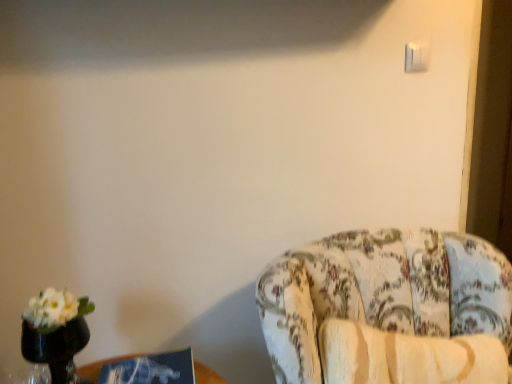
From the picture: Measure the distance between point (423, 67) and camera.

The depth of point (423, 67) is 1.33 meters.

The width and height of the screenshot is (512, 384). Describe the element at coordinates (416, 57) in the screenshot. I see `white plastic light switch at upper right` at that location.

Measure the distance between blue cardboard box at lower left and camera.

They are 3.59 feet apart.

Describe the element at coordinates (388, 309) in the screenshot. The image size is (512, 384). I see `floral fabric chair at right` at that location.

I want to click on white plastic light switch at upper right, so click(416, 57).

Can you confirm if floral fabric chair at right is shorter than blue cardboard box at lower left?

Incorrect, the height of floral fabric chair at right does not fall short of that of blue cardboard box at lower left.

From a real-world perspective, who is located higher, floral fabric chair at right or blue cardboard box at lower left?

blue cardboard box at lower left is physically above.

Can you see floral fabric chair at right touching blue cardboard box at lower left?

No, floral fabric chair at right is not beside blue cardboard box at lower left.

From the image's perspective, is floral fabric chair at right on white plastic light switch at upper right?

No.

Is floral fabric chair at right to the right of white plastic light switch at upper right from the viewer's perspective?

No.

This screenshot has width=512, height=384. Identify the location of chair that appears in front of the white plastic light switch at upper right. (388, 309).

Which object is positioned more to the right, white plastic light switch at upper right or floral fabric chair at right?

Positioned to the right is white plastic light switch at upper right.

Which is less distant, (426,53) or (416,322)?

Point (426,53).

Can you tell me how much white plastic light switch at upper right and floral fabric chair at right differ in facing direction?

white plastic light switch at upper right and floral fabric chair at right are facing 5.2 degrees away from each other.

From a real-world perspective, is white plastic light switch at upper right positioned above or below floral fabric chair at right?

white plastic light switch at upper right is above floral fabric chair at right.

Is the position of blue cardboard box at lower left less distant than that of white plastic light switch at upper right?

That is True.

From a real-world perspective, which is physically above, blue cardboard box at lower left or white plastic light switch at upper right?

white plastic light switch at upper right, from a real-world perspective.

What's the angular difference between blue cardboard box at lower left and white plastic light switch at upper right's facing directions?

9.8 degrees separate the facing orientations of blue cardboard box at lower left and white plastic light switch at upper right.

Is blue cardboard box at lower left wider or thinner than floral fabric chair at right?

In the image, blue cardboard box at lower left appears to be more narrow than floral fabric chair at right.

From the image's perspective, which one is positioned higher, blue cardboard box at lower left or floral fabric chair at right?

floral fabric chair at right, from the image's perspective.

Which of these two, blue cardboard box at lower left or floral fabric chair at right, is smaller?

blue cardboard box at lower left is smaller.

Does blue cardboard box at lower left appear on the left side of floral fabric chair at right?

Yes.

Is the surface of white plastic light switch at upper right in direct contact with blue cardboard box at lower left?

No.

Is white plastic light switch at upper right located outside blue cardboard box at lower left?

Indeed, white plastic light switch at upper right is completely outside blue cardboard box at lower left.

Between white plastic light switch at upper right and blue cardboard box at lower left, which one has larger width?

Wider between the two is blue cardboard box at lower left.

In the image, is white plastic light switch at upper right on the left side or the right side of blue cardboard box at lower left?

Clearly, white plastic light switch at upper right is on the right of blue cardboard box at lower left in the image.

Image resolution: width=512 pixels, height=384 pixels. In order to click on chair above the blue cardboard box at lower left (from the image's perspective) in this screenshot , I will do `click(388, 309)`.

This screenshot has height=384, width=512. What are the coordinates of `chair lying in front of the white plastic light switch at upper right` in the screenshot? It's located at (388, 309).

When comparing their distances from white plastic light switch at upper right, does blue cardboard box at lower left or floral fabric chair at right seem closer?

floral fabric chair at right is closer to white plastic light switch at upper right.

Which object lies nearer to the anchor point blue cardboard box at lower left, white plastic light switch at upper right or floral fabric chair at right?

floral fabric chair at right.

Considering their positions, is blue cardboard box at lower left positioned closer to floral fabric chair at right than white plastic light switch at upper right?

Among the two, blue cardboard box at lower left is located nearer to floral fabric chair at right.

Considering their positions, is floral fabric chair at right positioned further to white plastic light switch at upper right than blue cardboard box at lower left?

blue cardboard box at lower left lies further to white plastic light switch at upper right than the other object.

Looking at the image, which one is located closer to floral fabric chair at right, white plastic light switch at upper right or blue cardboard box at lower left?

Based on the image, blue cardboard box at lower left appears to be nearer to floral fabric chair at right.

Which object lies nearer to the anchor point blue cardboard box at lower left, floral fabric chair at right or white plastic light switch at upper right?

Based on the image, floral fabric chair at right appears to be nearer to blue cardboard box at lower left.

At what (x,y) coordinates should I click in order to perform the action: click on chair between white plastic light switch at upper right and blue cardboard box at lower left vertically. Please return your answer as a coordinate pair (x, y). Looking at the image, I should click on (388, 309).